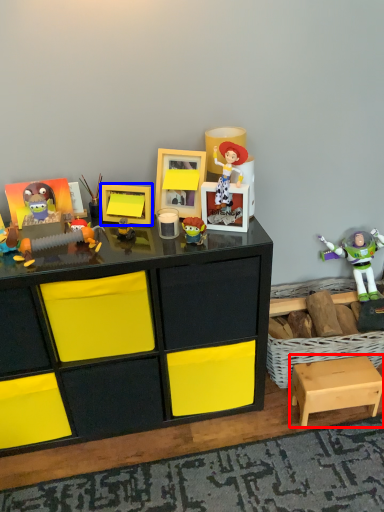
Question: Among these objects, which one is farthest to the camera, step stool (highlighted by a red box) or picture frame (highlighted by a blue box)?

Choices:
 (A) step stool
 (B) picture frame

Answer: (A)